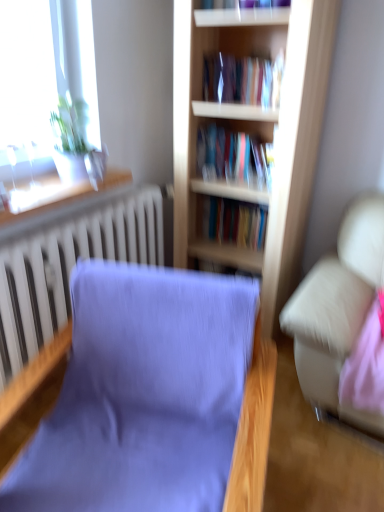
Question: From the image's perspective, is white textured radiator at left located beneath wooden window sill at upper left?

Choices:
 (A) yes
 (B) no

Answer: (A)

Question: From a real-world perspective, is white textured radiator at left on wooden window sill at upper left?

Choices:
 (A) yes
 (B) no

Answer: (B)

Question: Is white textured radiator at left taller than wooden window sill at upper left?

Choices:
 (A) no
 (B) yes

Answer: (B)

Question: Is white textured radiator at left to the left of wooden window sill at upper left from the viewer's perspective?

Choices:
 (A) no
 (B) yes

Answer: (A)

Question: Is white textured radiator at left turned away from wooden window sill at upper left?

Choices:
 (A) no
 (B) yes

Answer: (A)

Question: In terms of width, does wooden window sill at upper left look wider or thinner when compared to white textured radiator at left?

Choices:
 (A) thin
 (B) wide

Answer: (B)

Question: Based on their sizes in the image, would you say wooden window sill at upper left is bigger or smaller than white textured radiator at left?

Choices:
 (A) big
 (B) small

Answer: (B)

Question: Do you think wooden window sill at upper left is within white textured radiator at left, or outside of it?

Choices:
 (A) inside
 (B) outside

Answer: (B)

Question: Is point (34, 204) closer or farther from the camera than point (14, 360)?

Choices:
 (A) closer
 (B) farther

Answer: (A)

Question: From a real-world perspective, is white textured radiator at left positioned above or below purple fabric chair at center?

Choices:
 (A) above
 (B) below

Answer: (A)

Question: Is white textured radiator at left inside the boundaries of purple fabric chair at center, or outside?

Choices:
 (A) outside
 (B) inside

Answer: (A)

Question: From the image's perspective, is white textured radiator at left above or below purple fabric chair at center?

Choices:
 (A) below
 (B) above

Answer: (B)

Question: Considering the positions of white textured radiator at left and purple fabric chair at center in the image, is white textured radiator at left bigger or smaller than purple fabric chair at center?

Choices:
 (A) small
 (B) big

Answer: (A)

Question: From a real-world perspective, relative to white textured radiator at left, is light wood bookcase at center vertically above or below?

Choices:
 (A) below
 (B) above

Answer: (B)

Question: Is point (306, 100) closer or farther from the camera than point (21, 333)?

Choices:
 (A) farther
 (B) closer

Answer: (A)